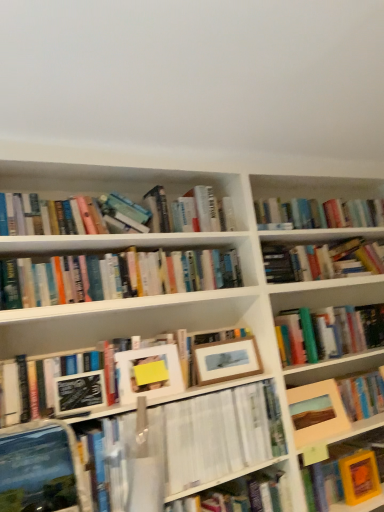
Question: From a real-world perspective, is matte black paperback book at center-left, which is the 2th paperback book in right-to-left order, above or below hardcover book at center, which appears as the 2th book when ordered from the bottom?

Choices:
 (A) above
 (B) below

Answer: (B)

Question: Looking at their shapes, would you say matte black paperback book at center-left, the 1th paperback book in the front-to-back sequence, is wider or thinner than hardcover book at center, which is the 1th book in top-to-bottom order?

Choices:
 (A) thin
 (B) wide

Answer: (A)

Question: Estimate the real-world distances between objects in this image. Which object is closer to the hardcover book at center, which appears as the 2th book when ordered from the bottom?

Choices:
 (A) matte black paperback book at center-left, which is the 2th paperback book in bottom-to-top order
 (B) orange matte book at lower right, which appears as the second paperback book when viewed from the left
 (C) white matte book at center, acting as the 1th book starting from the bottom
 (D) wooden picture frame at center, acting as the second picture frame starting from the left
 (E) matte white picture frame at center, arranged as the third picture frame when viewed from the right

Answer: (D)

Question: Considering the real-world distances, which object is closest to the white matte book at center, which appears as the second book when viewed from the top?

Choices:
 (A) wooden picture frame at center right, the third picture frame positioned from the left
 (B) matte white picture frame at center, which appears as the 1th picture frame when viewed from the left
 (C) hardcover book at center, which is the 1th book in top-to-bottom order
 (D) orange matte book at lower right, the 1th paperback book ordered from the bottom
 (E) wooden picture frame at center, which is the 2th picture frame from right to left

Answer: (E)